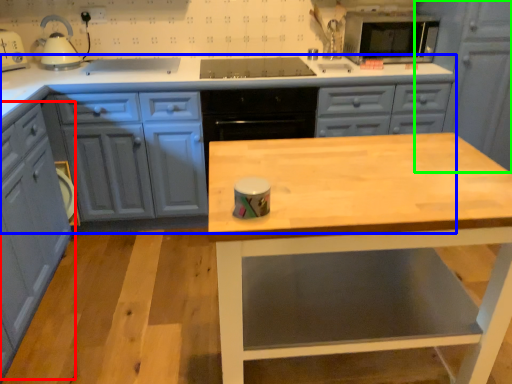
Question: Based on their relative distances, which object is farther from cabinetry (highlighted by a red box)? Choose from cabinetry (highlighted by a blue box) and cabinetry (highlighted by a green box).

Choices:
 (A) cabinetry
 (B) cabinetry

Answer: (B)